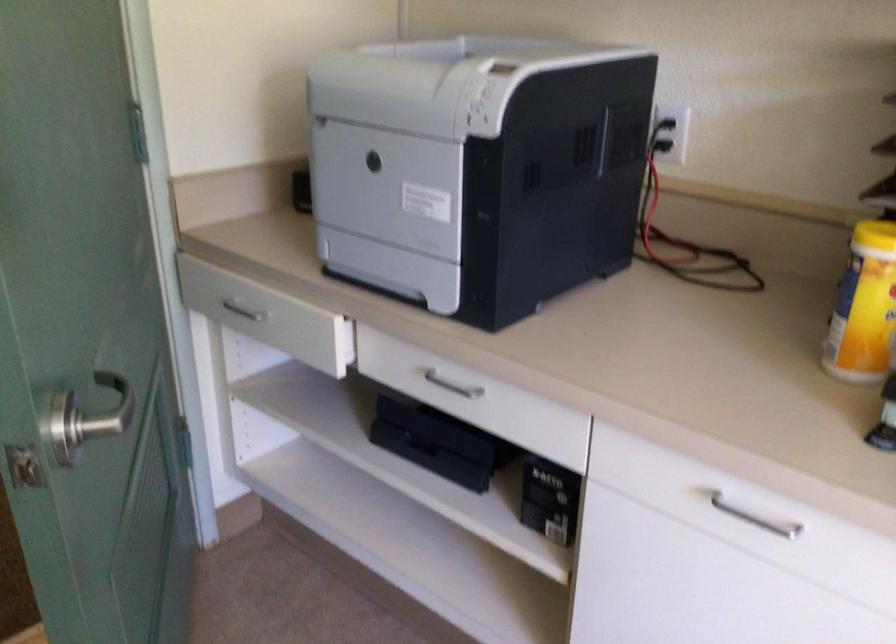
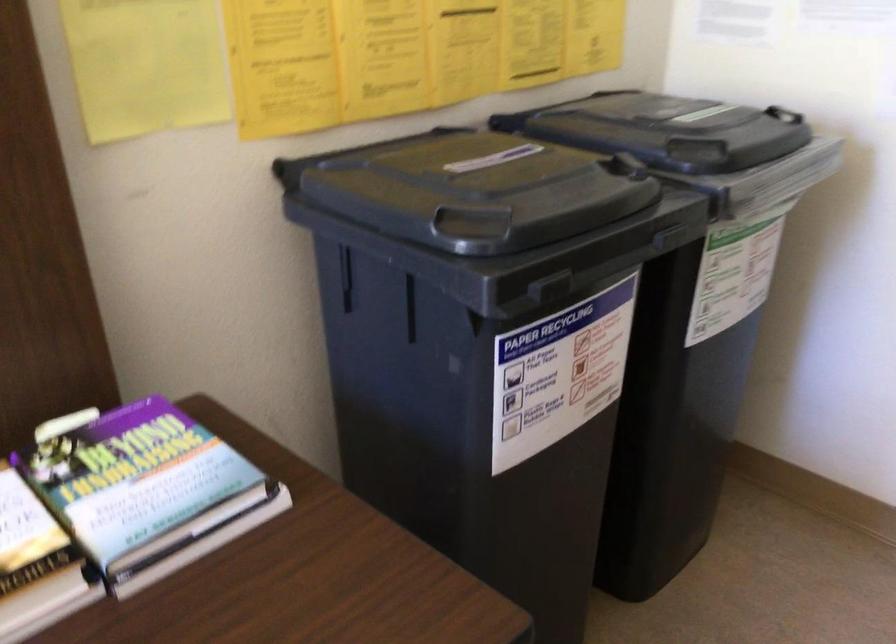
How did the camera likely rotate?

The rotation direction of the camera is left-down.